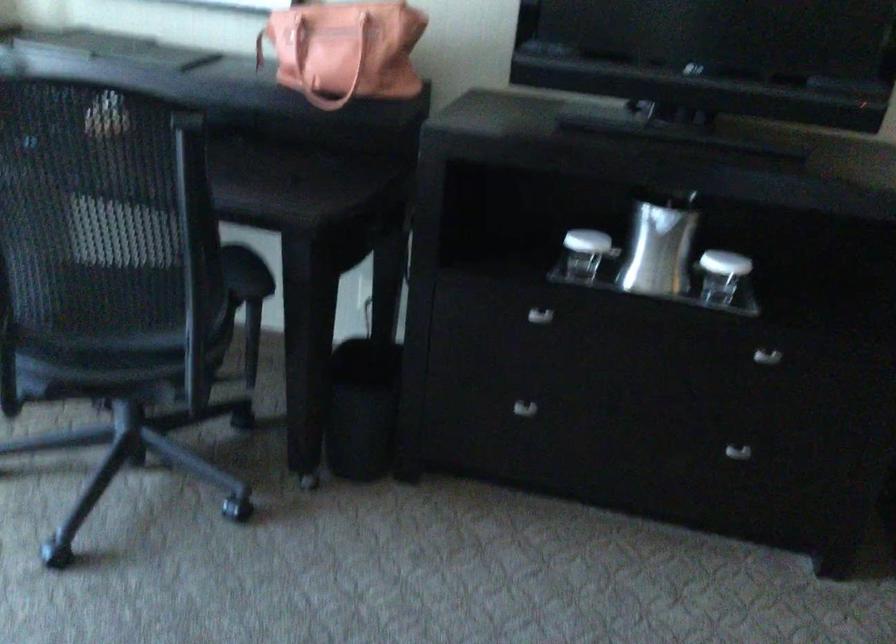
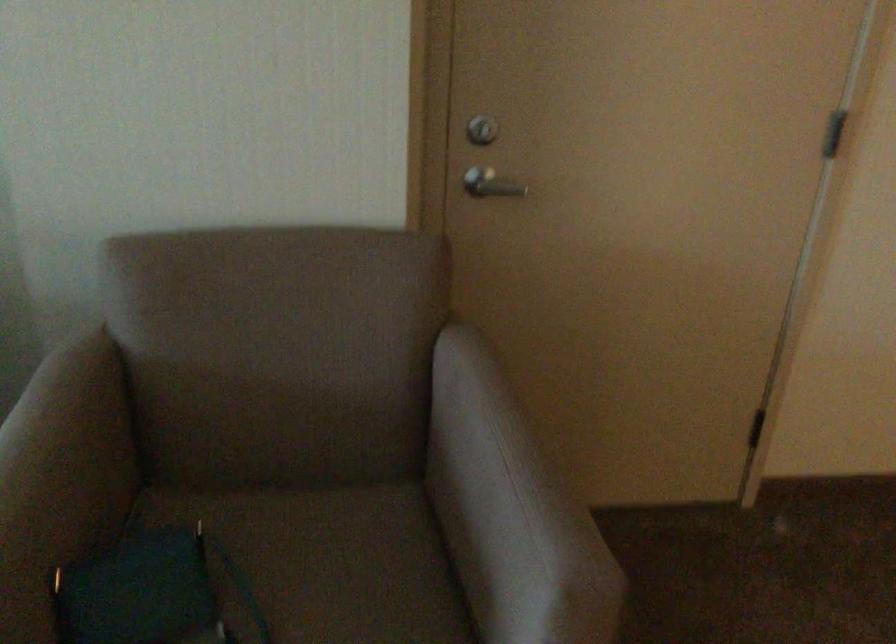
Question: The images are taken continuously from a first-person perspective. In which direction are you moving?

Choices:
 (A) Left
 (B) Right
 (C) Forward
 (D) Backward

Answer: (B)